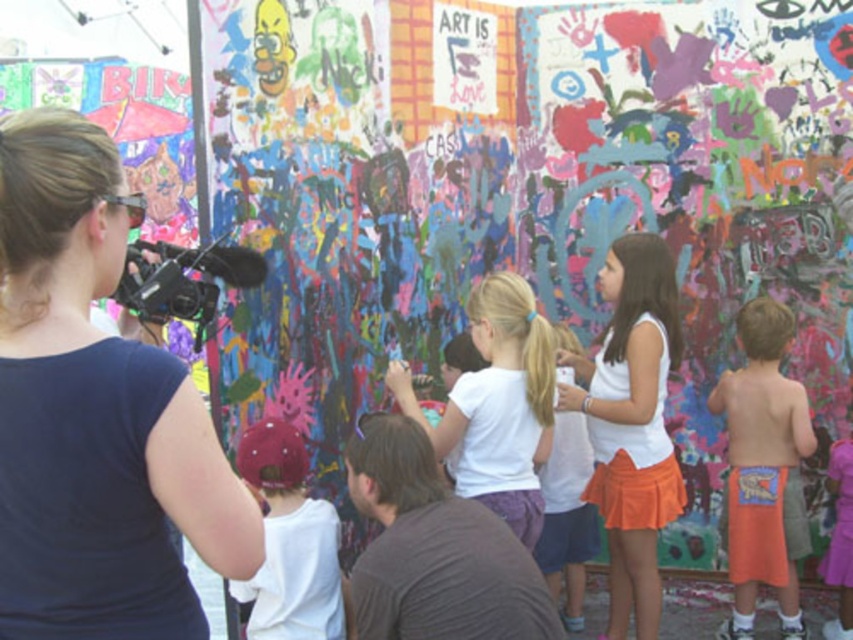
You are a photographer at the event and need to position yourself so that both the white matte tank top at center and the pink satin dress at lower right are in frame. Given their height difference, which one should you focus on to ensure both are visible?

The white matte tank top at center is taller than the pink satin dress at lower right, so focusing on the white matte tank top at center will help ensure both are visible in the frame.

You are a photographer at the event and need to capture a photo that includes both the white matte tank top at center and the orange cotton shorts at right. Based on their positions, which one should you ensure is placed higher in your photo?

The white matte tank top at center is located above the orange cotton shorts at right, so in your photo, you should ensure the white matte tank top at center is placed higher to reflect their actual positions.

You are a photographer at the event and want to capture the orange cotton shorts at right and the white matte shirt at center in the same frame. Which one should you position closer to the left side of your camera viewfinder to include both?

To include both the orange cotton shorts at right and the white matte shirt at center in the same frame, position the white matte shirt at center closer to the left side of your camera viewfinder since the orange cotton shorts at right are to the right of it.